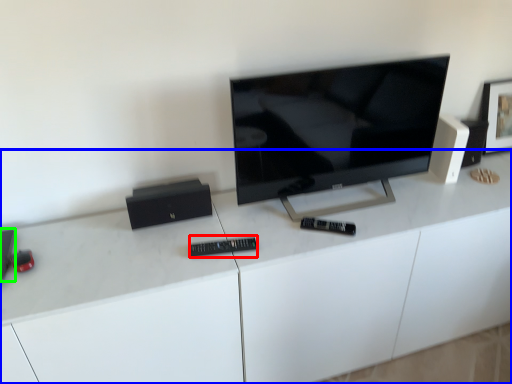
Question: Which is farther away from control (highlighted by a red box)? desk (highlighted by a blue box) or speaker (highlighted by a green box)?

Choices:
 (A) desk
 (B) speaker

Answer: (B)